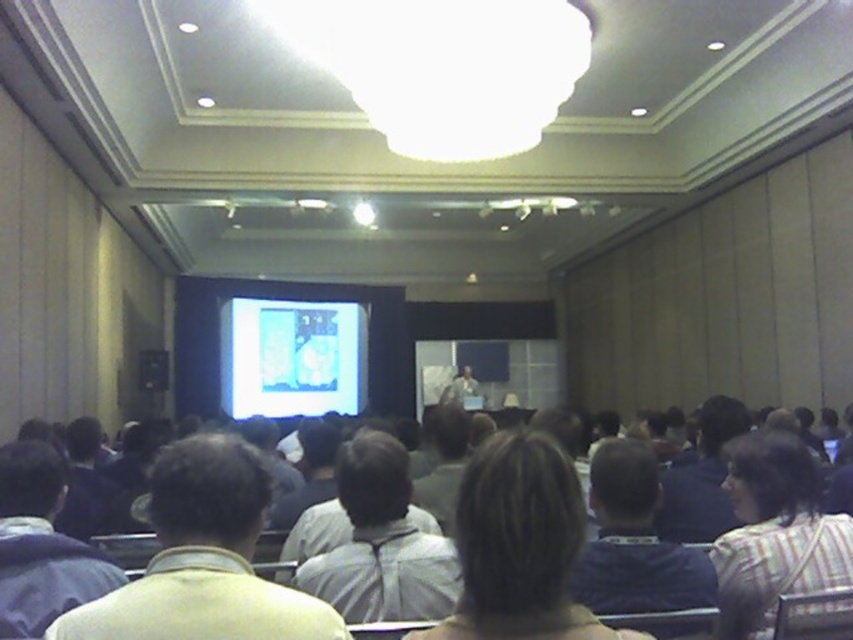
Question: Estimate the real-world distances between objects in this image. Which object is closer to the yellow fabric shirt at center?

Choices:
 (A) white glossy projector screen at center
 (B) light gray shirt at center
 (C) gray fabric shirt at center
 (D) light brown shirt at center

Answer: (C)

Question: Does light gray shirt at center come in front of light blue shirt at center?

Choices:
 (A) no
 (B) yes

Answer: (B)

Question: Can you confirm if striped cotton shirt at lower right is thinner than light gray shirt at center?

Choices:
 (A) yes
 (B) no

Answer: (B)

Question: Among these points, which one is nearest to the camera?

Choices:
 (A) (178, 532)
 (B) (25, 595)
 (C) (614, 506)
 (D) (428, 611)

Answer: (A)

Question: Is yellow fabric shirt at center closer to the viewer compared to light gray shirt at center?

Choices:
 (A) yes
 (B) no

Answer: (A)

Question: Which object is the closest to the white glossy projector screen at center?

Choices:
 (A) yellow fabric shirt at center
 (B) striped cotton shirt at lower right
 (C) light blue shirt at center

Answer: (C)